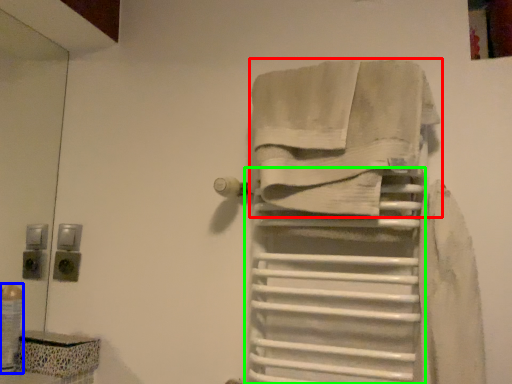
Question: Based on their relative distances, which object is nearer to towel (highlighted by a red box)? Choose from toiletry (highlighted by a blue box) and shelf (highlighted by a green box).

Choices:
 (A) toiletry
 (B) shelf

Answer: (B)